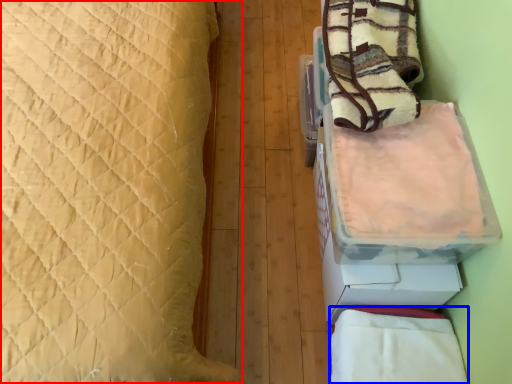
Question: Which of the following is the farthest to the observer, bed (highlighted by a red box) or blanket (highlighted by a blue box)?

Choices:
 (A) bed
 (B) blanket

Answer: (B)